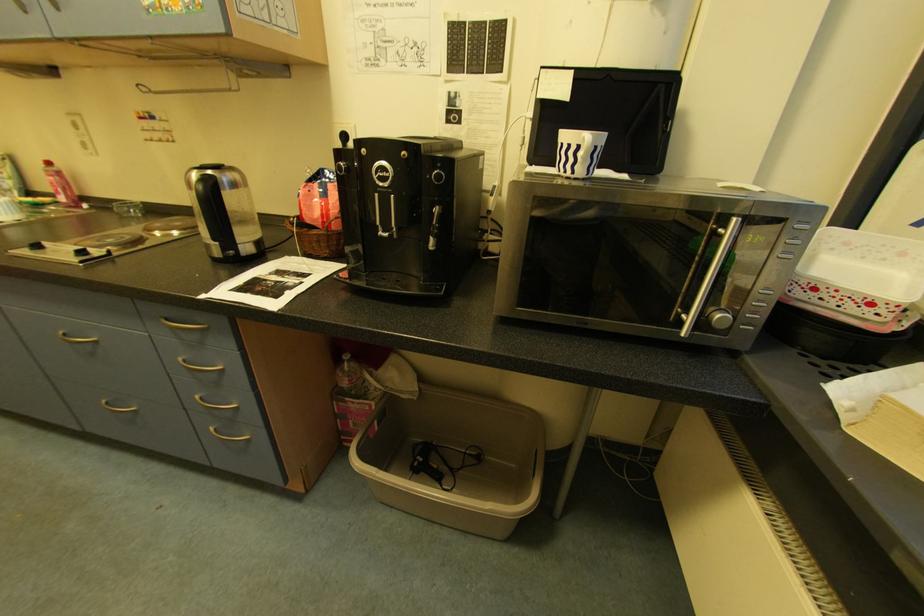
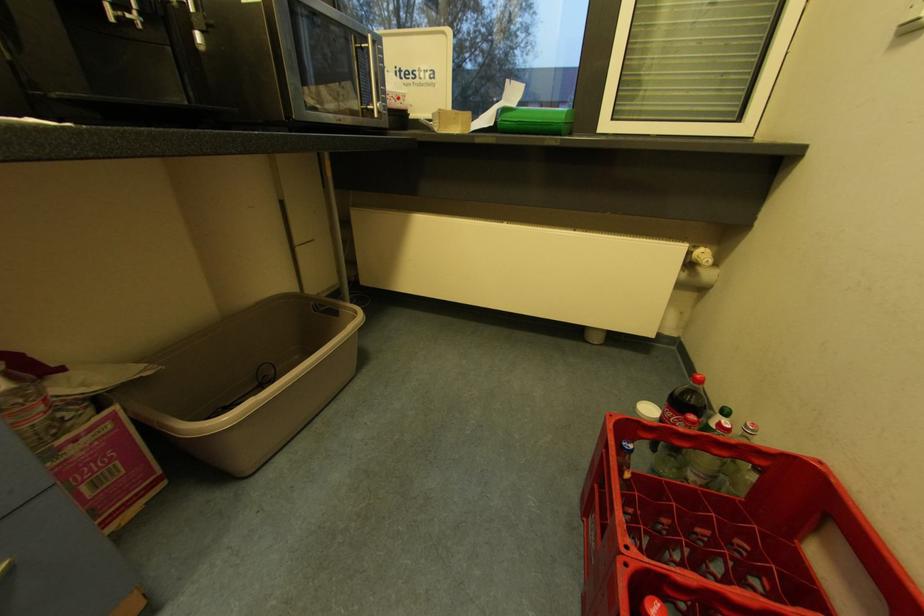
First-person continuous shooting, in which direction is the camera rotating?

The rotation direction of the camera is right-down.